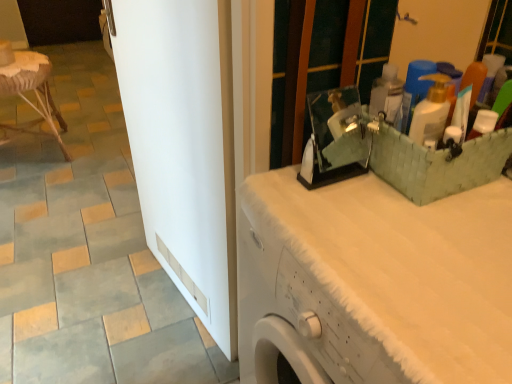
Question: From a real-world perspective, is gray matte tile at lower left physically located above or below rattan stool at left?

Choices:
 (A) above
 (B) below

Answer: (B)

Question: Is gray matte tile at lower left bigger or smaller than rattan stool at left?

Choices:
 (A) big
 (B) small

Answer: (B)

Question: Which object is positioned closest to the rattan stool at left?

Choices:
 (A) white glossy door at center
 (B) gray matte tile at lower left
 (C) white textured counter top at upper right

Answer: (A)

Question: Considering the real-world distances, which object is closest to the white glossy door at center?

Choices:
 (A) gray matte tile at lower left
 (B) rattan stool at left
 (C) white textured counter top at upper right

Answer: (C)